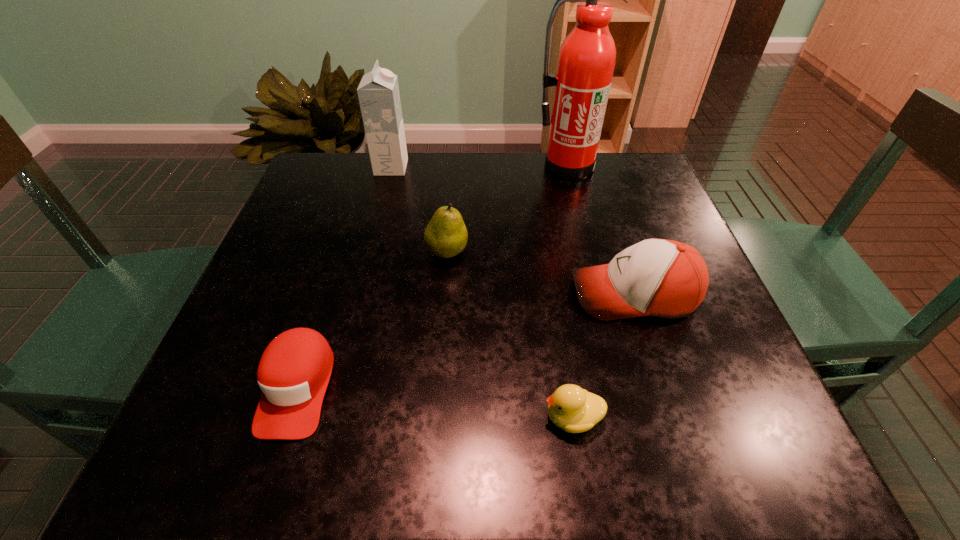
The height and width of the screenshot is (540, 960). Identify the location of blank space located 0.360m on the front label of the carton. 541,167.

Locate an element on the screen. This screenshot has width=960, height=540. free location located 0.350m on the right of the pear is located at coordinates (632, 252).

Where is `free location located on the front-facing side of the right baseball cap`? free location located on the front-facing side of the right baseball cap is located at coordinates click(443, 294).

Identify the location of free space located on the front-facing side of the right baseball cap. tap(468, 294).

Locate an element on the screen. vacant region located 0.100m on the front-facing side of the right baseball cap is located at coordinates (519, 294).

At what (x,y) coordinates should I click in order to perform the action: click on vacant space located on the beak of the duckling. Please return your answer as a coordinate pair (x, y). Looking at the image, I should click on (485, 417).

You are a GUI agent. You are given a task and a screenshot of the screen. Output one action in this format:
    pyautogui.click(x=<x>, y=<y>)
    Task: Click on the free space located on the beak of the duckling
    The image size is (960, 540).
    Given the screenshot: What is the action you would take?
    pyautogui.click(x=317, y=417)

Where is `vacant space located 0.110m on the beak of the duckling`? vacant space located 0.110m on the beak of the duckling is located at coordinates click(471, 417).

Identify the location of fire extinguisher at the far edge. Image resolution: width=960 pixels, height=540 pixels. (586, 61).

You are a GUI agent. You are given a task and a screenshot of the screen. Output one action in this format:
    pyautogui.click(x=<x>, y=<y>)
    Task: Click on the carton that is at the far edge
    Image resolution: width=960 pixels, height=540 pixels.
    Given the screenshot: What is the action you would take?
    pyautogui.click(x=378, y=93)